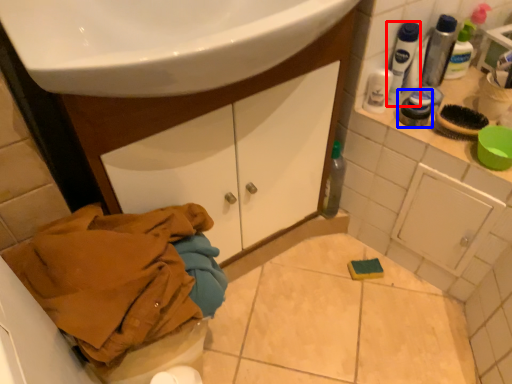
Question: Among these objects, which one is nearest to the camera, mouthwash (highlighted by a red box) or toiletry (highlighted by a blue box)?

Choices:
 (A) mouthwash
 (B) toiletry

Answer: (A)